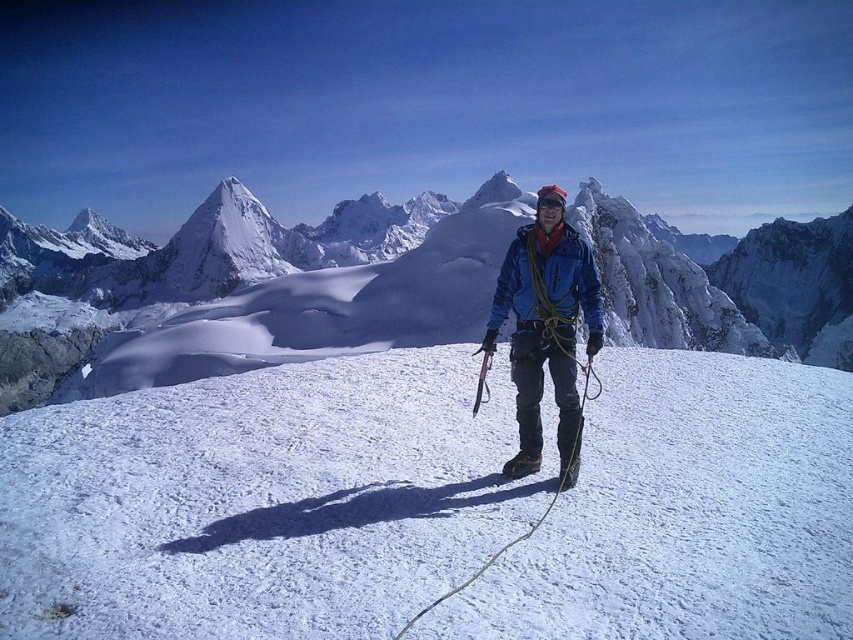
Question: Which object is positioned farthest from the white snow-covered mountain at center?

Choices:
 (A) blue fabric jacket at center
 (B) white frosty snow at center

Answer: (A)

Question: Observing the image, what is the correct spatial positioning of white frosty snow at center in reference to blue fabric jacket at center?

Choices:
 (A) above
 (B) below

Answer: (B)

Question: Estimate the real-world distances between objects in this image. Which object is closer to the blue fabric jacket at center?

Choices:
 (A) white frosty snow at center
 (B) white snow-covered mountain at center

Answer: (A)

Question: Can you confirm if white snow-covered mountain at center is smaller than blue fabric jacket at center?

Choices:
 (A) no
 (B) yes

Answer: (A)

Question: Which object appears closest to the camera in this image?

Choices:
 (A) blue fabric jacket at center
 (B) white snow-covered mountain at center

Answer: (A)

Question: Is white frosty snow at center closer to the viewer compared to blue fabric jacket at center?

Choices:
 (A) no
 (B) yes

Answer: (B)